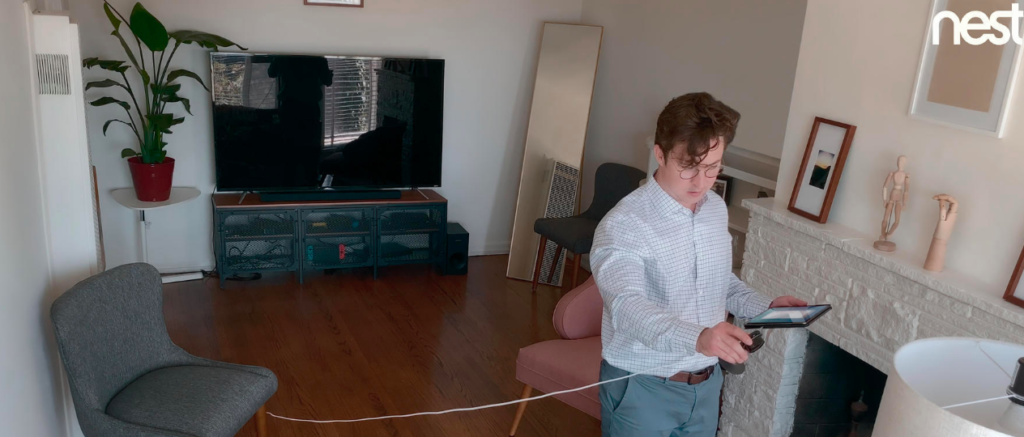
Image resolution: width=1024 pixels, height=437 pixels. Find the location of `television`. television is located at coordinates (322, 138).